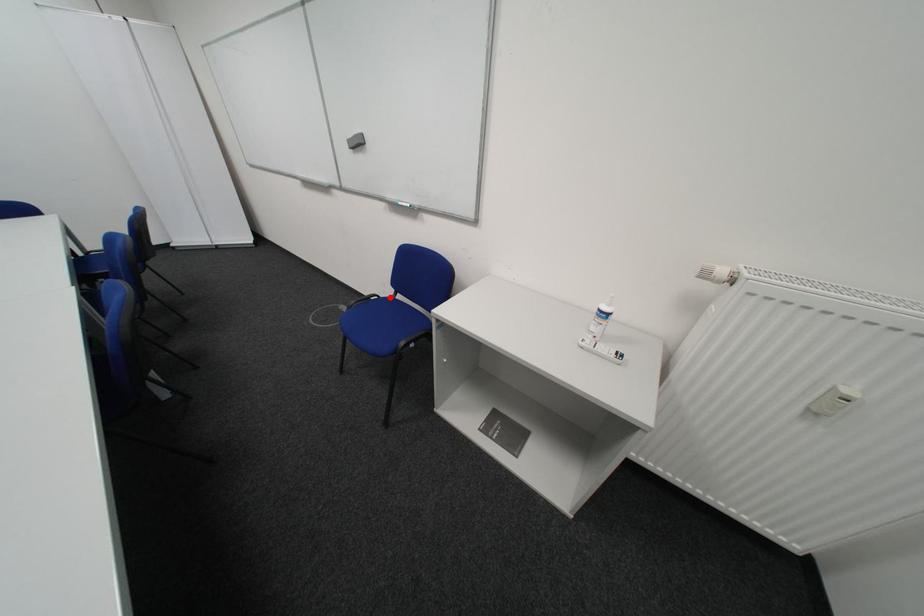
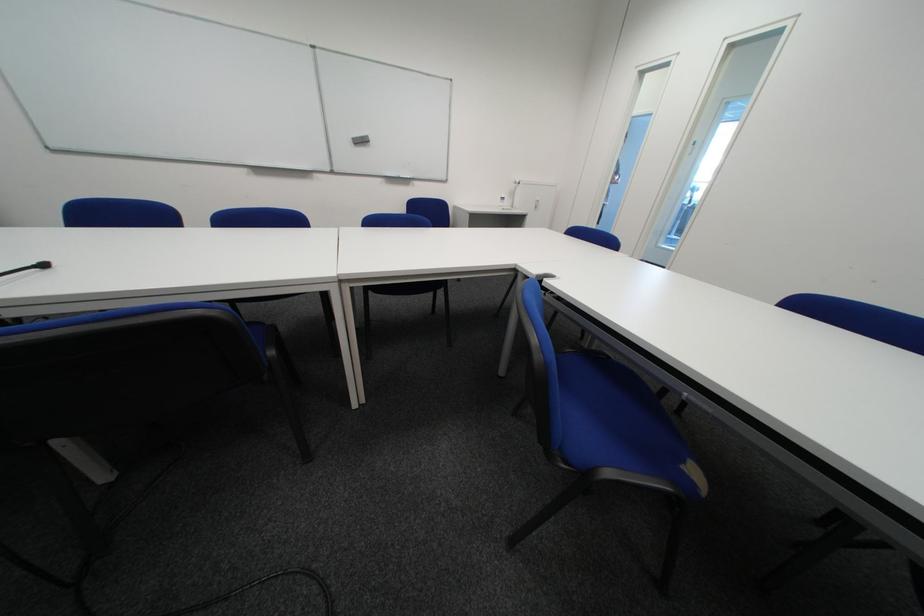
Question: I am providing you with two images of the same scene from different viewpoints. A red point is marked on the first image. Is the red point's position out of view in image 2?

Choices:
 (A) Yes
 (B) No

Answer: (A)